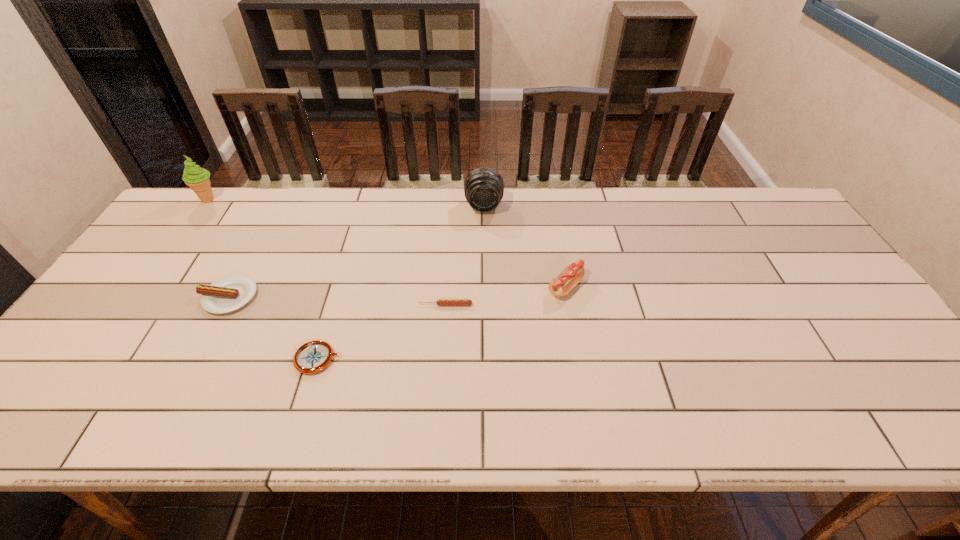
Identify the location of the second sausage from left to right. The width and height of the screenshot is (960, 540). click(x=440, y=302).

Identify the location of vacant space situated 0.350m on the front of the leftmost object. (147, 285).

I want to click on vacant space located 0.360m at the front element of the telephoto lens, so click(x=485, y=300).

Locate an element on the screen. This screenshot has width=960, height=540. free space located 0.370m on the right of the third tallest object is located at coordinates (721, 287).

What are the coordinates of `vacant space positioned on the left of the second object from left to right` in the screenshot? It's located at pos(170,296).

Find the location of `free point located on the right of the fourth object from right to left`. free point located on the right of the fourth object from right to left is located at coordinates (464, 359).

Identify the location of vacant area located 0.200m on the left of the second sausage from right to left. (343, 305).

This screenshot has width=960, height=540. Find the location of `icecream situated at the far edge`. icecream situated at the far edge is located at coordinates (197, 178).

The width and height of the screenshot is (960, 540). What are the coordinates of `telephoto lens located in the far edge section of the desktop` in the screenshot? It's located at (483, 188).

Where is `object at the left edge`? This screenshot has width=960, height=540. object at the left edge is located at coordinates (197, 178).